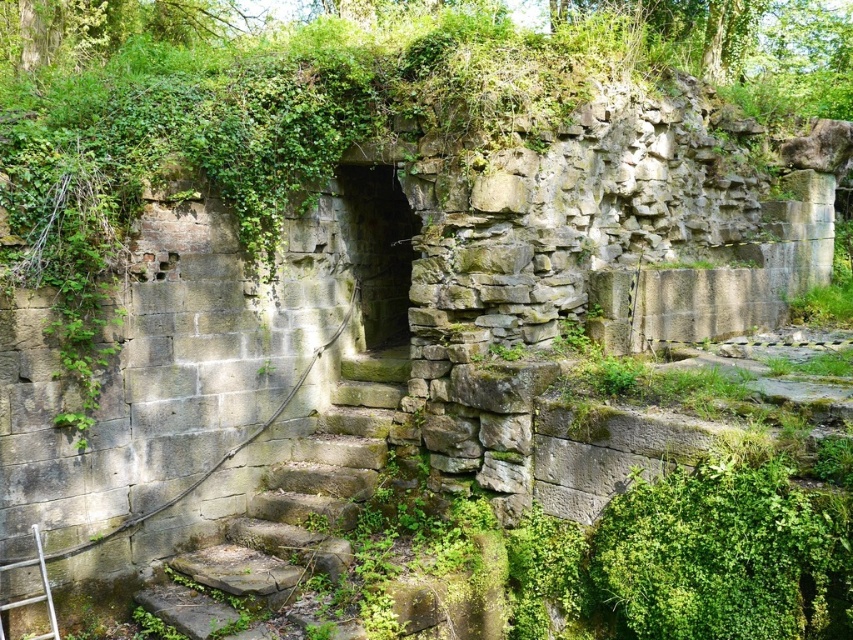
Question: Observing the image, what is the correct spatial positioning of stone steps at center in reference to silver metallic ladder at lower left?

Choices:
 (A) right
 (B) left

Answer: (A)

Question: Does stone steps at center have a larger size compared to silver metallic ladder at lower left?

Choices:
 (A) no
 (B) yes

Answer: (B)

Question: Among these points, which one is nearest to the camera?

Choices:
 (A) pos(346,468)
 (B) pos(12,605)

Answer: (B)

Question: Which object appears farthest from the camera in this image?

Choices:
 (A) silver metallic ladder at lower left
 (B) stone steps at center

Answer: (B)

Question: Can you confirm if stone steps at center is smaller than silver metallic ladder at lower left?

Choices:
 (A) no
 (B) yes

Answer: (A)